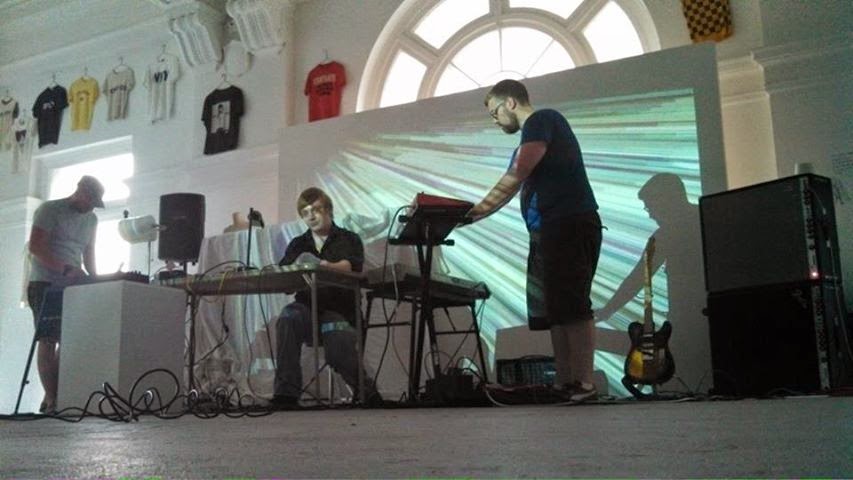
The width and height of the screenshot is (853, 480). What are the coordinates of `floor` in the screenshot? It's located at (322, 455).